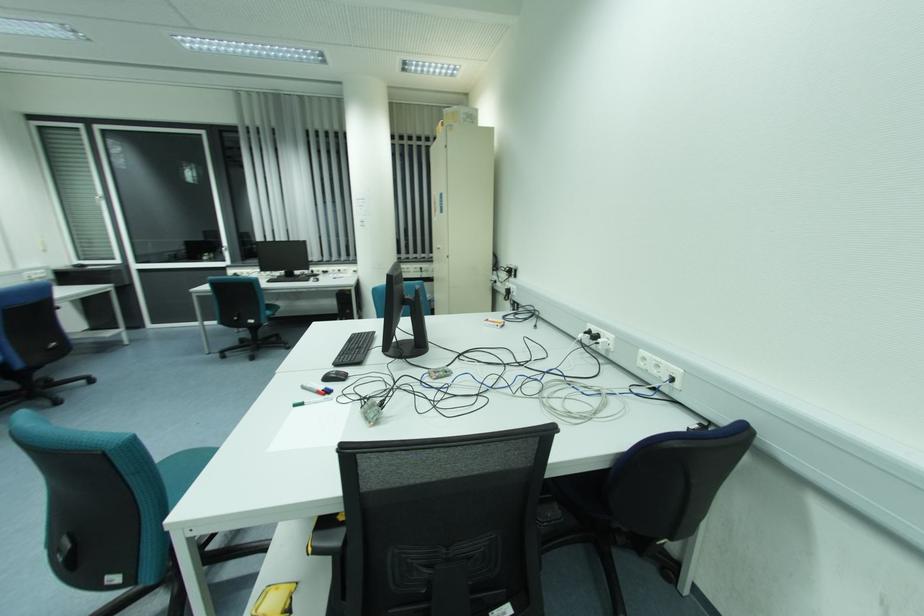
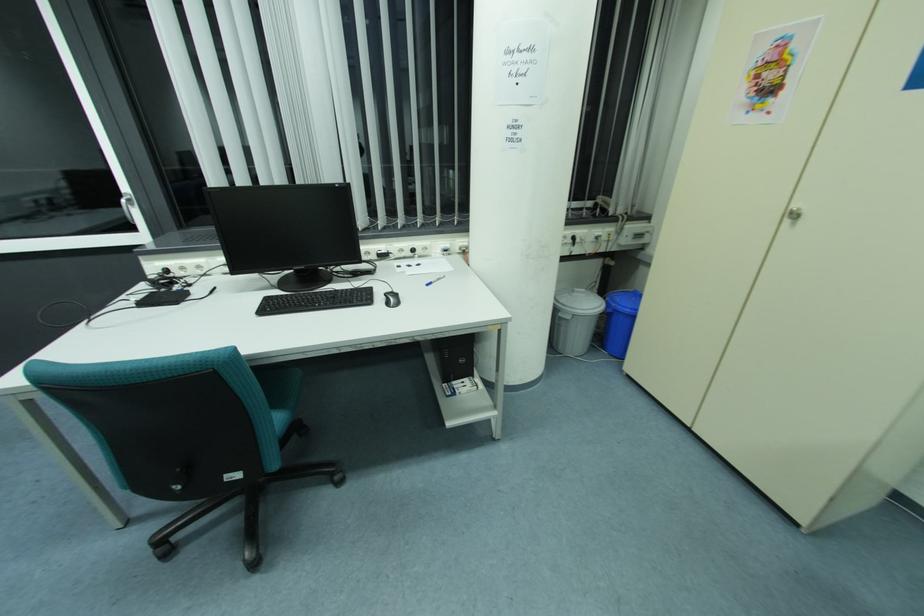
In the second image, find the point that corresponds to the point at 225,249 in the first image.

(125, 201)